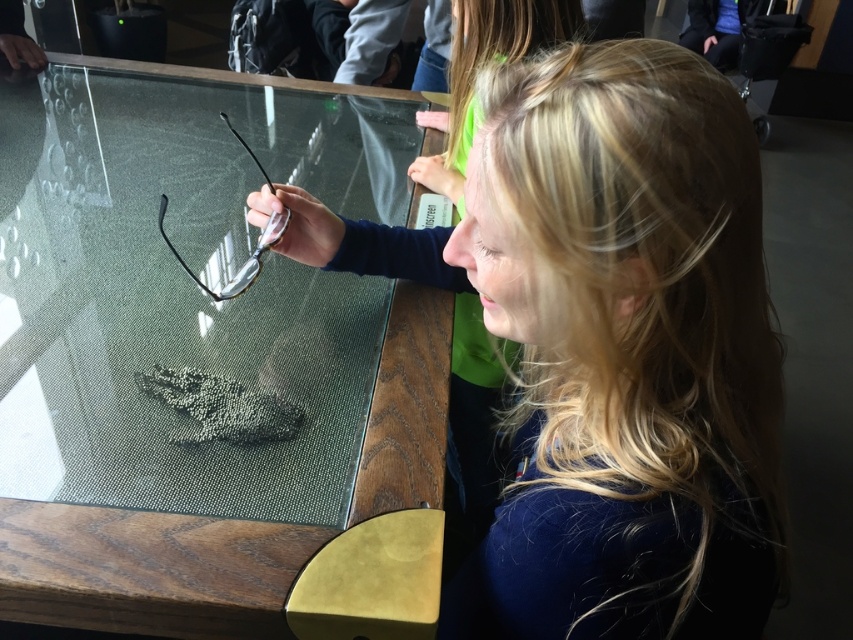
Which is more to the left, blonde hair at upper right or black textured footprint at center?

From the viewer's perspective, black textured footprint at center appears more on the left side.

Does point (645, 177) lie in front of point (210, 401)?

Yes, it is.

Find the location of a particular element. This screenshot has height=640, width=853. blonde hair at upper right is located at coordinates (608, 346).

Which is behind, point (519, 132) or point (117, 100)?

Point (117, 100)

Measure the distance between point [608,420] and camera.

Point [608,420] is 19.86 inches away from camera.

Locate an element on the screen. blonde hair at upper right is located at coordinates (608, 346).

Can you confirm if transparent textured glass at center is positioned to the right of black textured footprint at center?

Incorrect, transparent textured glass at center is not on the right side of black textured footprint at center.

Find the location of a particular element. The image size is (853, 640). transparent textured glass at center is located at coordinates (181, 288).